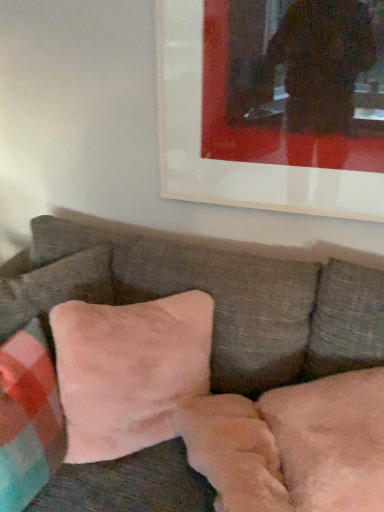
Question: From a real-world perspective, is suede-like beige pillow at lower left, the 2th pillow viewed from the left, physically located above or below velvet pink pillow at center, placed as the 1th pillow when sorted from left to right?

Choices:
 (A) above
 (B) below

Answer: (A)

Question: Considering their positions, is suede-like beige pillow at lower left, the second pillow from the right, located in front of or behind velvet pink pillow at center, the third pillow from the right?

Choices:
 (A) behind
 (B) front

Answer: (A)

Question: Which is farther from the velvet pink pillow at center, placed as the 1th pillow when sorted from left to right?

Choices:
 (A) velvet pink pillow at center
 (B) suede-like pink pillow at center, arranged as the third pillow when viewed from the left
 (C) suede-like beige pillow at lower left, the second pillow from the right

Answer: (A)

Question: Estimate the real-world distances between objects in this image. Which object is closer to the suede-like pink pillow at center, which appears as the first pillow when viewed from the right?

Choices:
 (A) velvet pink pillow at center, placed as the 1th pillow when sorted from left to right
 (B) suede-like beige pillow at lower left, the 2th pillow viewed from the left
 (C) velvet pink pillow at center

Answer: (A)